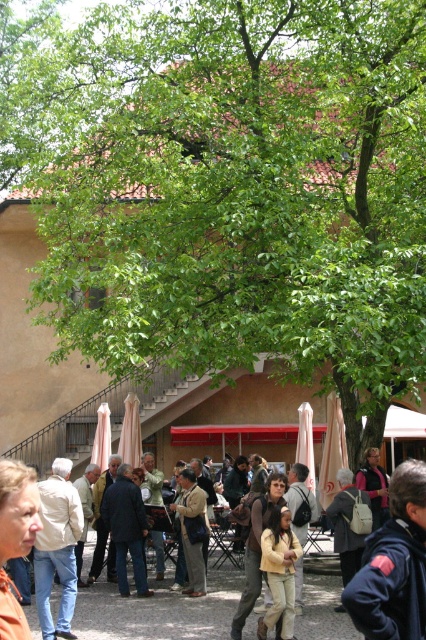
Question: Can you confirm if white cotton jacket at center is smaller than khaki cotton pants at center?

Choices:
 (A) yes
 (B) no

Answer: (B)

Question: Is the position of tan leather jacket at center less distant than that of leather jacket at center?

Choices:
 (A) yes
 (B) no

Answer: (B)

Question: Is dark gray jacket at center in front of light yellow fabric jacket at center?

Choices:
 (A) no
 (B) yes

Answer: (A)

Question: Which of the following is the farthest from the observer?

Choices:
 (A) (293, 605)
 (B) (301, 564)
 (C) (37, 576)

Answer: (B)

Question: Which point is farther from the camera taking this photo?

Choices:
 (A) (258, 508)
 (B) (23, 625)

Answer: (A)

Question: Which point appears closest to the camera in this image?

Choices:
 (A) (37, 516)
 (B) (307, 502)

Answer: (A)